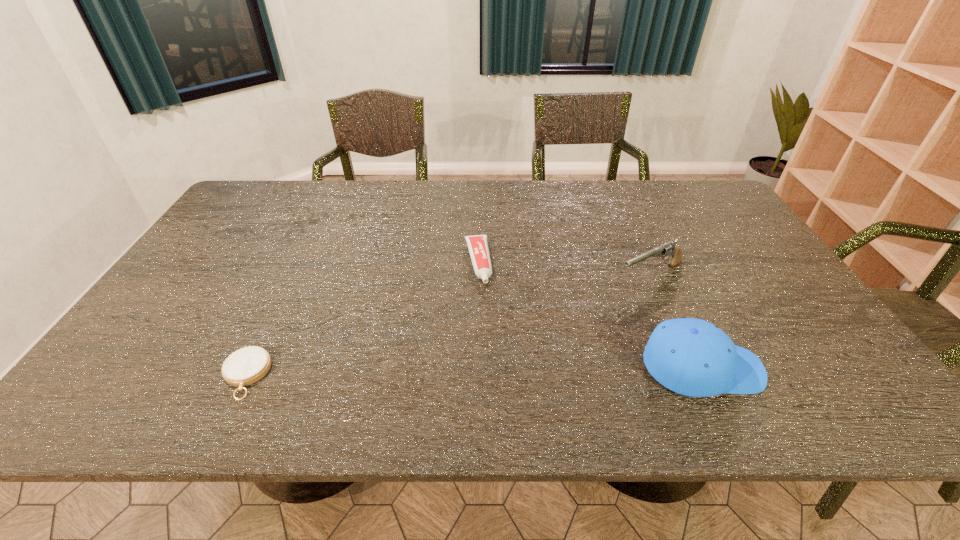
Where is `free space between the tallest object and the leftmost object`? Image resolution: width=960 pixels, height=540 pixels. free space between the tallest object and the leftmost object is located at coordinates (473, 372).

You are a GUI agent. You are given a task and a screenshot of the screen. Output one action in this format:
    pyautogui.click(x=<x>, y=<y>)
    Task: Click on the object that is the closest to the third shortest object
    
    Given the screenshot: What is the action you would take?
    pyautogui.click(x=693, y=357)

I want to click on object that ranks as the third closest to the compass, so click(x=667, y=249).

The image size is (960, 540). In order to click on vacant area that satisfies the following two spatial constraints: 1. on the front side of the toothpaste; 2. on the right side of the third shortest object in this screenshot , I will do `click(478, 275)`.

You are a GUI agent. You are given a task and a screenshot of the screen. Output one action in this format:
    pyautogui.click(x=<x>, y=<y>)
    Task: Click on the vacant space that satisfies the following two spatial constraints: 1. on the back side of the shortest object; 2. on the front-facing side of the cap
    Image resolution: width=960 pixels, height=540 pixels.
    Given the screenshot: What is the action you would take?
    pyautogui.click(x=249, y=368)

Where is `vacant region that satisfies the following two spatial constraints: 1. on the front side of the tallest object; 2. on the front-facing side of the gun`? vacant region that satisfies the following two spatial constraints: 1. on the front side of the tallest object; 2. on the front-facing side of the gun is located at coordinates (692, 368).

Image resolution: width=960 pixels, height=540 pixels. Find the location of `free region that satisfies the following two spatial constraints: 1. on the front side of the second tallest object; 2. on the front-facing side of the tallest object`. free region that satisfies the following two spatial constraints: 1. on the front side of the second tallest object; 2. on the front-facing side of the tallest object is located at coordinates (692, 368).

Identify the location of blank area in the image that satisfies the following two spatial constraints: 1. on the back side of the leftmost object; 2. on the left side of the third tallest object. This screenshot has width=960, height=540. (300, 262).

The height and width of the screenshot is (540, 960). What are the coordinates of `free location that satisfies the following two spatial constraints: 1. on the front side of the toothpaste; 2. on the front-facing side of the cap` in the screenshot? It's located at (477, 368).